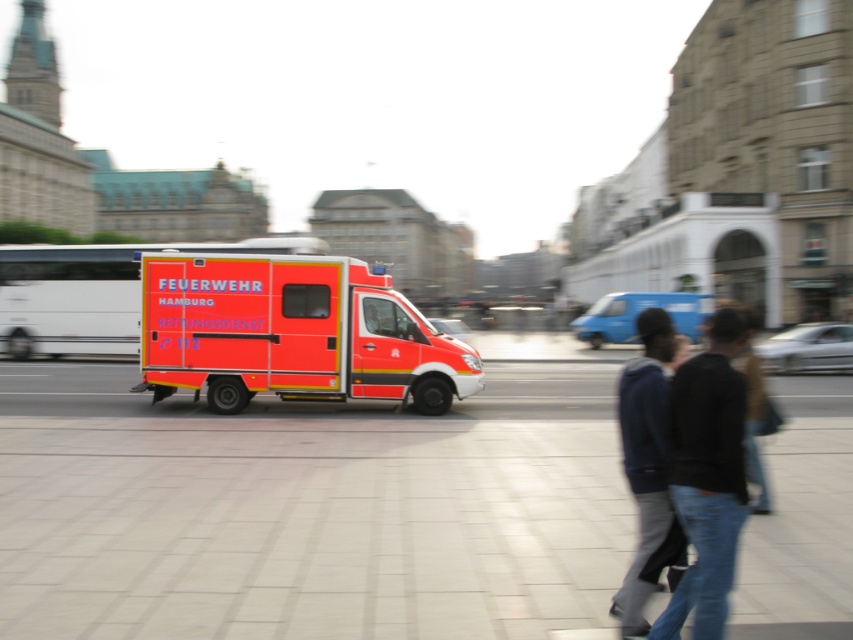
Question: Is smooth concrete pavement at center below dark blue jacket at center?

Choices:
 (A) no
 (B) yes

Answer: (B)

Question: Which object is the farthest from the dark blue jacket at lower right?

Choices:
 (A) dark blue jacket at center
 (B) smooth concrete pavement at center
 (C) orange matte ambulance at center

Answer: (C)

Question: Which point appears closest to the camera in this image?

Choices:
 (A) (358, 490)
 (B) (668, 518)
 (C) (728, 488)
 (D) (302, 321)

Answer: (C)

Question: Does smooth concrete pavement at center appear on the right side of dark blue jacket at center?

Choices:
 (A) yes
 (B) no

Answer: (A)

Question: Does smooth concrete pavement at center appear on the left side of dark blue jacket at center?

Choices:
 (A) yes
 (B) no

Answer: (B)

Question: Which point appears farthest from the camera in this image?

Choices:
 (A) (596, 488)
 (B) (677, 547)
 (C) (724, 566)
 (D) (216, 362)

Answer: (D)